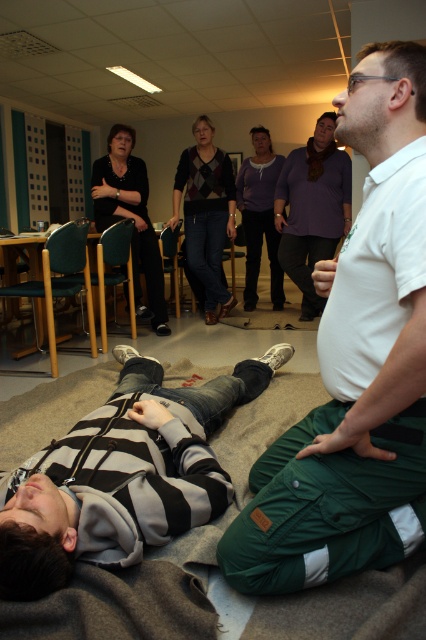
You are a fashion designer observing the indoor scene. You notice the argyle sweater at center and the black matte shirt at upper left. Which clothing item is positioned higher in the image?

The argyle sweater at center is taller than the black matte shirt at upper left, so the argyle sweater at center is positioned higher in the image.

You are observing a first aid training session in a classroom. You notice two participants wearing a black matte shirt at upper left and a matte gray sweater at center. Which participant is closer to the front of the room?

The black matte shirt at upper left is closer to the front of the room because it is in front of the matte gray sweater at center.